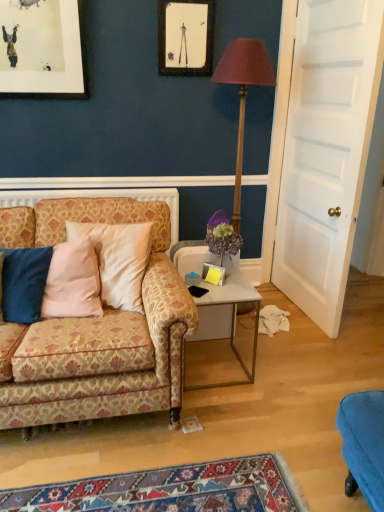
Question: Is matte black picture frame at upper center at the back of wooden floor lamp at center?

Choices:
 (A) no
 (B) yes

Answer: (A)

Question: Is wooden floor lamp at center taller than matte black picture frame at upper center?

Choices:
 (A) no
 (B) yes

Answer: (B)

Question: Can you confirm if wooden floor lamp at center is positioned to the left of matte black picture frame at upper center?

Choices:
 (A) no
 (B) yes

Answer: (A)

Question: Could matte black picture frame at upper center be considered to be inside wooden floor lamp at center?

Choices:
 (A) yes
 (B) no

Answer: (B)

Question: From a real-world perspective, is wooden floor lamp at center located higher than matte black picture frame at upper center?

Choices:
 (A) yes
 (B) no

Answer: (B)

Question: From a real-world perspective, is matte purple vase at center positioned above or below white glossy side table at center?

Choices:
 (A) below
 (B) above

Answer: (B)

Question: Is matte purple vase at center spatially inside white glossy side table at center, or outside of it?

Choices:
 (A) inside
 (B) outside

Answer: (B)

Question: In the image, is matte purple vase at center on the left side or the right side of white glossy side table at center?

Choices:
 (A) right
 (B) left

Answer: (A)

Question: Relative to white glossy side table at center, is matte purple vase at center in front or behind?

Choices:
 (A) behind
 (B) front

Answer: (A)

Question: From the image's perspective, relative to white wooden door at right, is matte black picture frame at upper center above or below?

Choices:
 (A) above
 (B) below

Answer: (A)

Question: In terms of width, does matte black picture frame at upper center look wider or thinner when compared to white wooden door at right?

Choices:
 (A) thin
 (B) wide

Answer: (A)

Question: Is matte black picture frame at upper center taller or shorter than white wooden door at right?

Choices:
 (A) short
 (B) tall

Answer: (A)

Question: Choose the correct answer: Is matte black picture frame at upper center inside white wooden door at right or outside it?

Choices:
 (A) outside
 (B) inside

Answer: (A)

Question: Considering the positions of matte black picture frame at upper center and white glossy side table at center in the image, is matte black picture frame at upper center taller or shorter than white glossy side table at center?

Choices:
 (A) short
 (B) tall

Answer: (A)

Question: Is point (200, 3) closer or farther from the camera than point (178, 266)?

Choices:
 (A) closer
 (B) farther

Answer: (B)